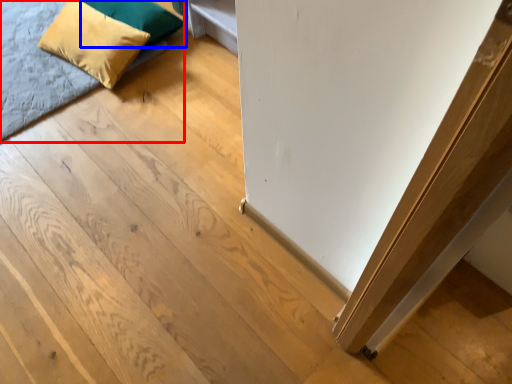
Question: Which of the following is the farthest to the observer, bed (highlighted by a red box) or pillow (highlighted by a blue box)?

Choices:
 (A) bed
 (B) pillow

Answer: (B)